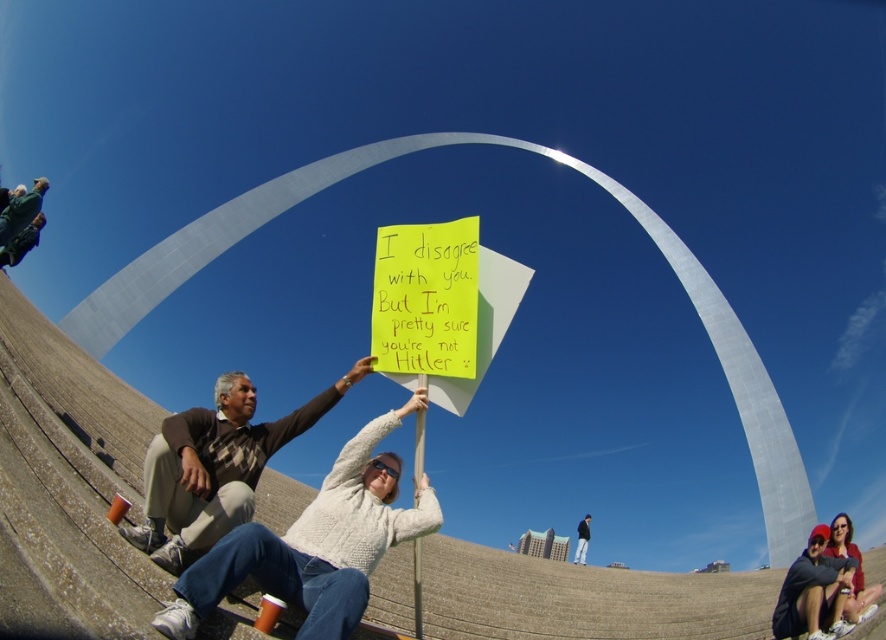
Question: Which point is farther to the camera?

Choices:
 (A) (298, 435)
 (B) (576, 541)

Answer: (B)

Question: Can you confirm if brown sweater at center is smaller than dark blue jeans at lower right?

Choices:
 (A) yes
 (B) no

Answer: (A)

Question: Is brown sweater at center behind dark blue jeans at lower right?

Choices:
 (A) yes
 (B) no

Answer: (B)

Question: Which point is farther to the camera?

Choices:
 (A) (581, 525)
 (B) (302, 419)

Answer: (A)

Question: Which object appears farthest from the camera in this image?

Choices:
 (A) dark blue jeans at lower right
 (B) brown sweater at center

Answer: (A)

Question: Is brown sweater at center closer to the viewer compared to dark blue jeans at lower right?

Choices:
 (A) no
 (B) yes

Answer: (B)